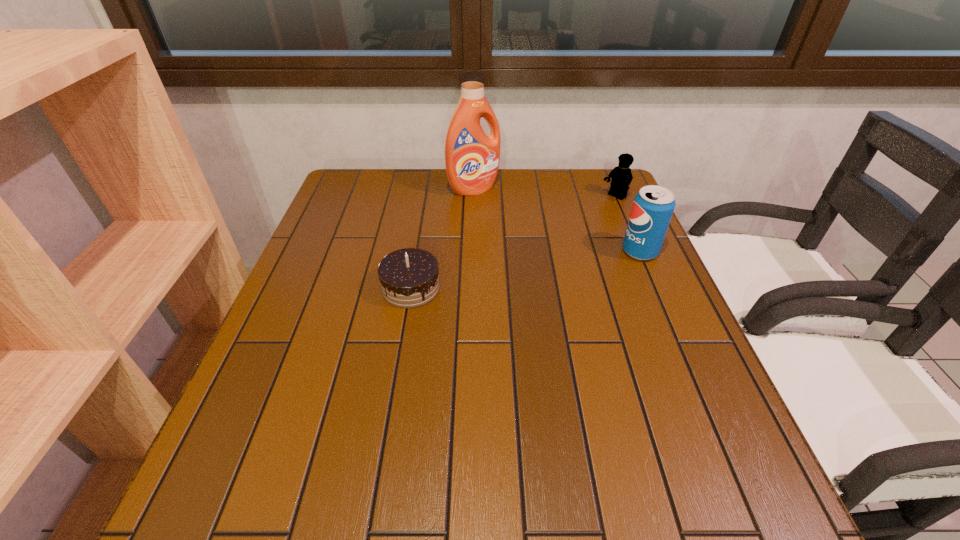
Identify the location of vacant area situated on the front-facing side of the third tallest object. Image resolution: width=960 pixels, height=540 pixels. (551, 241).

Locate an element on the screen. This screenshot has width=960, height=540. free location located 0.330m on the front-facing side of the tallest object is located at coordinates (548, 257).

At what (x,y) coordinates should I click in order to perform the action: click on vacant space positioned 0.240m on the front-facing side of the tallest object. Please return your answer as a coordinate pair (x, y). This screenshot has width=960, height=540. Looking at the image, I should click on (529, 238).

Locate an element on the screen. The width and height of the screenshot is (960, 540). blank area located 0.240m on the front-facing side of the tallest object is located at coordinates (529, 238).

This screenshot has width=960, height=540. I want to click on Lego present at the far edge, so click(621, 176).

Where is `detergent located at the far edge`? Image resolution: width=960 pixels, height=540 pixels. detergent located at the far edge is located at coordinates (472, 158).

Locate an element on the screen. The height and width of the screenshot is (540, 960). soda can that is positioned at the right edge is located at coordinates (653, 206).

At what (x,y) coordinates should I click in order to perform the action: click on Lego present at the right edge. Please return your answer as a coordinate pair (x, y). This screenshot has width=960, height=540. Looking at the image, I should click on (621, 176).

Identify the location of object that is at the far right corner. (621, 176).

Where is `vacant space at the far edge of the desktop`? vacant space at the far edge of the desktop is located at coordinates click(x=534, y=204).